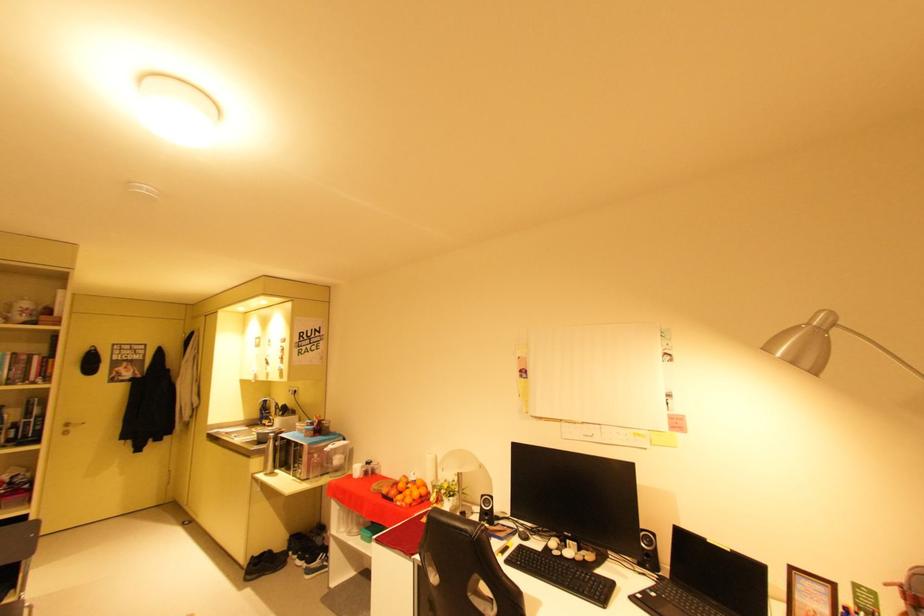
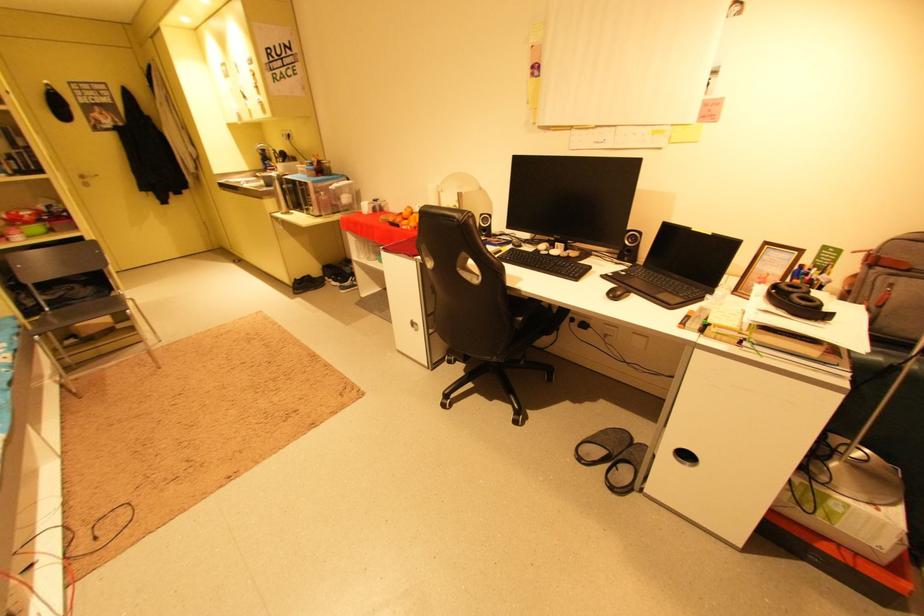
In the second image, find the point that corresponds to [652,543] in the first image.

(638, 241)